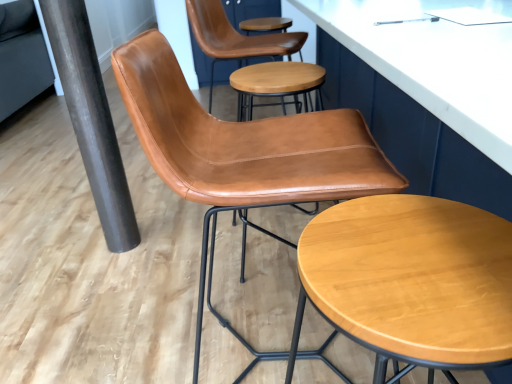
Image resolution: width=512 pixels, height=384 pixels. What do you see at coordinates (91, 119) in the screenshot? I see `black metallic pole at lower left` at bounding box center [91, 119].

Identify the location of cognac leather chair at center. (242, 156).

Are black metallic pole at lower left and light brown wood stool at center beside each other?

No, black metallic pole at lower left is not in contact with light brown wood stool at center.

In the image, is black metallic pole at lower left positioned in front of or behind light brown wood stool at center?

Visually, black metallic pole at lower left is located behind light brown wood stool at center.

Between point (97, 174) and point (397, 208), which one is positioned behind?

The point (97, 174) is farther.

Locate an element on the screen. This screenshot has height=384, width=512. beam above the light brown wood stool at center (from a real-world perspective) is located at coordinates (91, 119).

Considering the points (379, 187) and (69, 61), which point is behind, point (379, 187) or point (69, 61)?

Positioned behind is point (69, 61).

Between cognac leather chair at center and black metallic pole at lower left, which one has smaller size?

With smaller size is black metallic pole at lower left.

Which is in front, cognac leather chair at center or black metallic pole at lower left?

cognac leather chair at center is in front.

Is light brown wood stool at center positioned with its back to cognac leather chair at center?

No, light brown wood stool at center's orientation is not away from cognac leather chair at center.

Can you confirm if light brown wood stool at center is shorter than cognac leather chair at center?

Yes, light brown wood stool at center is shorter than cognac leather chair at center.

Is light brown wood stool at center wider or thinner than cognac leather chair at center?

In the image, light brown wood stool at center appears to be more narrow than cognac leather chair at center.

From the image's perspective, who appears lower, light brown wood stool at center or cognac leather chair at center?

From the image's view, light brown wood stool at center is below.

Is light brown wood stool at center to the left or to the right of black metallic pole at lower left in the image?

Based on their positions, light brown wood stool at center is located to the right of black metallic pole at lower left.

Is light brown wood stool at center positioned with its back to black metallic pole at lower left?

No.

From the image's perspective, which is below, light brown wood stool at center or black metallic pole at lower left?

light brown wood stool at center is shown below in the image.

From a real-world perspective, is black metallic pole at lower left positioned above or below cognac leather chair at center?

Clearly, from a real-world perspective, black metallic pole at lower left is above cognac leather chair at center.

Considering the relative positions of black metallic pole at lower left and cognac leather chair at center in the image provided, is black metallic pole at lower left to the left or to the right of cognac leather chair at center?

In the image, black metallic pole at lower left appears on the left side of cognac leather chair at center.

Does black metallic pole at lower left have a smaller size compared to cognac leather chair at center?

Correct, black metallic pole at lower left occupies less space than cognac leather chair at center.

Is black metallic pole at lower left completely or partially outside of cognac leather chair at center?

Yes.

Find the location of a particular element. chair lying behind the light brown wood stool at center is located at coordinates (242, 156).

From the image's perspective, which one is positioned higher, cognac leather chair at center or light brown wood stool at center?

cognac leather chair at center, from the image's perspective.

Which is more to the left, cognac leather chair at center or light brown wood stool at center?

cognac leather chair at center is more to the left.

In the scene shown: Who is smaller, cognac leather chair at center or light brown wood stool at center?

Smaller between the two is light brown wood stool at center.

Where is `beam on the left of light brown wood stool at center`? The height and width of the screenshot is (384, 512). beam on the left of light brown wood stool at center is located at coordinates (91, 119).

The width and height of the screenshot is (512, 384). Identify the location of beam above the cognac leather chair at center (from the image's perspective). (91, 119).

Which object lies nearer to the anchor point light brown wood stool at center, black metallic pole at lower left or cognac leather chair at center?

cognac leather chair at center is positioned closer to the anchor light brown wood stool at center.

When comparing their distances from black metallic pole at lower left, does cognac leather chair at center or light brown wood stool at center seem closer?

cognac leather chair at center is positioned closer to the anchor black metallic pole at lower left.

Considering their positions, is light brown wood stool at center positioned further to black metallic pole at lower left than cognac leather chair at center?

light brown wood stool at center.

Looking at the image, which one is located closer to cognac leather chair at center, light brown wood stool at center or black metallic pole at lower left?

The object closer to cognac leather chair at center is light brown wood stool at center.

Considering their positions, is cognac leather chair at center positioned closer to light brown wood stool at center than black metallic pole at lower left?

cognac leather chair at center is positioned closer to the anchor light brown wood stool at center.

From the image, which object appears to be nearer to cognac leather chair at center, black metallic pole at lower left or light brown wood stool at center?

light brown wood stool at center is closer to cognac leather chair at center.

In order to click on chair between light brown wood stool at center and black metallic pole at lower left from front to back in this screenshot , I will do `click(242, 156)`.